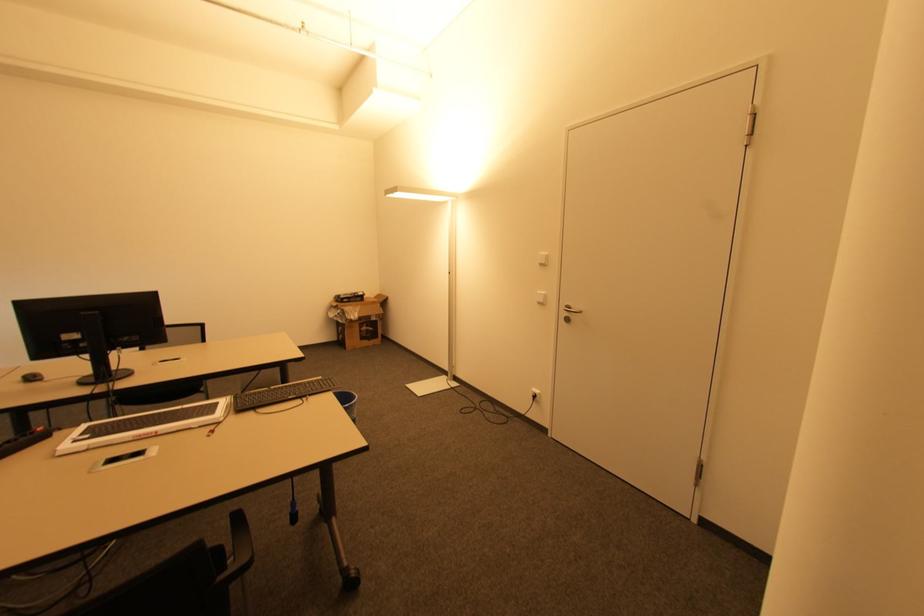
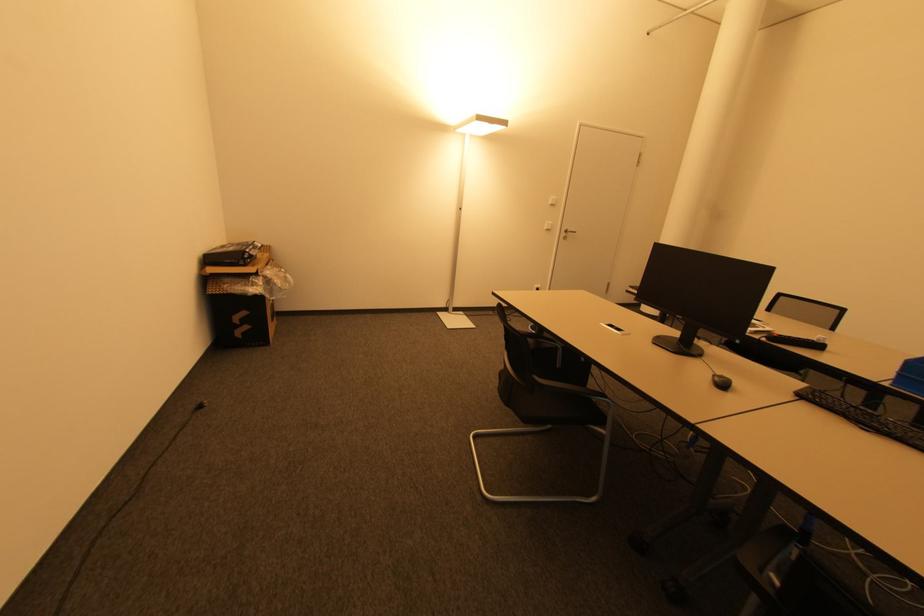
Locate, in the second image, the point that corresponds to [347,301] in the first image.

(250, 261)